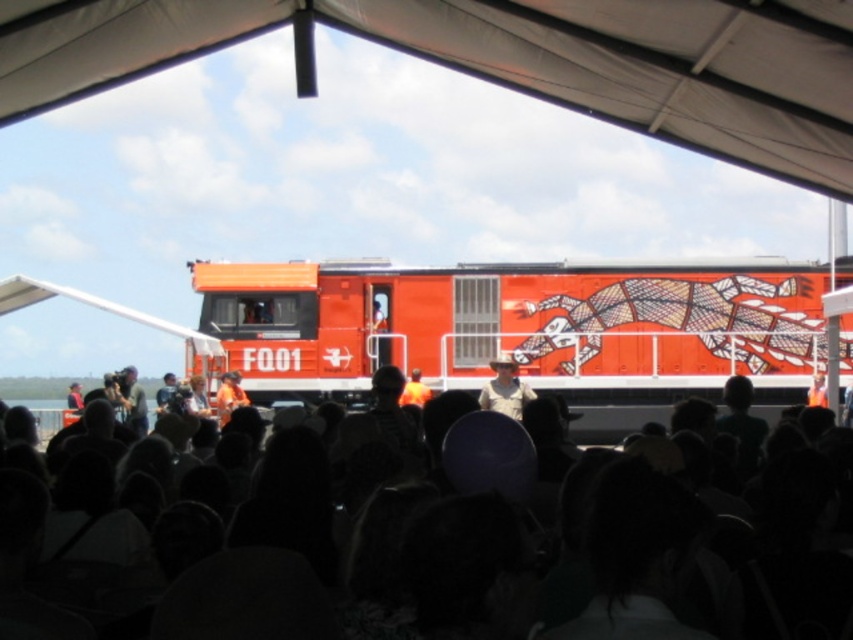
Does khaki fabric hat at center have a greater height compared to orange fabric at center?

Yes, khaki fabric hat at center is taller than orange fabric at center.

Locate an element on the screen. khaki fabric hat at center is located at coordinates (505, 388).

The image size is (853, 640). What are the coordinates of `khaki fabric hat at center` in the screenshot? It's located at (505, 388).

Between orange matte train at center and orange fabric at center, which one appears on the left side from the viewer's perspective?

orange fabric at center is more to the left.

Does orange matte train at center have a greater height compared to orange fabric at center?

Correct, orange matte train at center is much taller as orange fabric at center.

Is point (549, 310) in front of point (419, 400)?

Yes, it is.

Find the location of a particular element. This screenshot has height=640, width=853. orange matte train at center is located at coordinates (518, 323).

Measure the distance from white fabric canopy at upper center to white fabric tent at upper center.

white fabric canopy at upper center and white fabric tent at upper center are 15.47 inches apart from each other.

I want to click on white fabric canopy at upper center, so click(506, 60).

The width and height of the screenshot is (853, 640). I want to click on white fabric canopy at upper center, so click(506, 60).